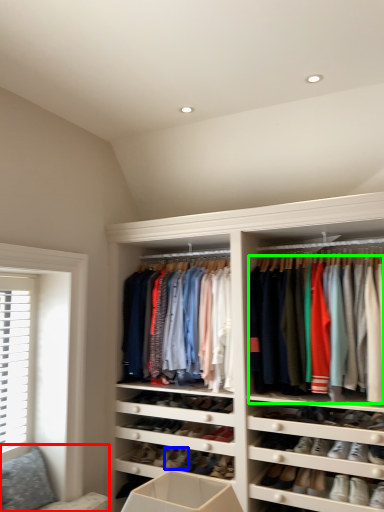
Question: Which object is the closest to the couch (highlighted by a red box)? Choose among these: shoe (highlighted by a blue box) or clothing (highlighted by a green box).

Choices:
 (A) shoe
 (B) clothing

Answer: (A)